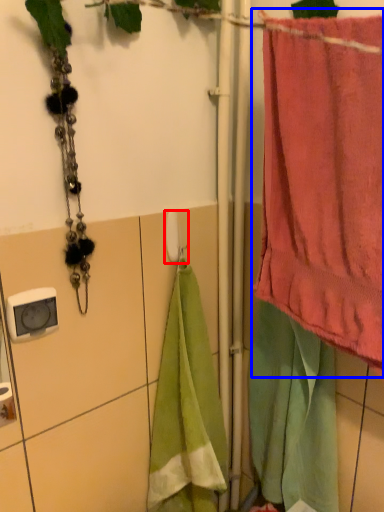
Question: Which object appears closest to the camera in this image, towel bar (highlighted by a red box) or towel (highlighted by a blue box)?

Choices:
 (A) towel bar
 (B) towel

Answer: (B)